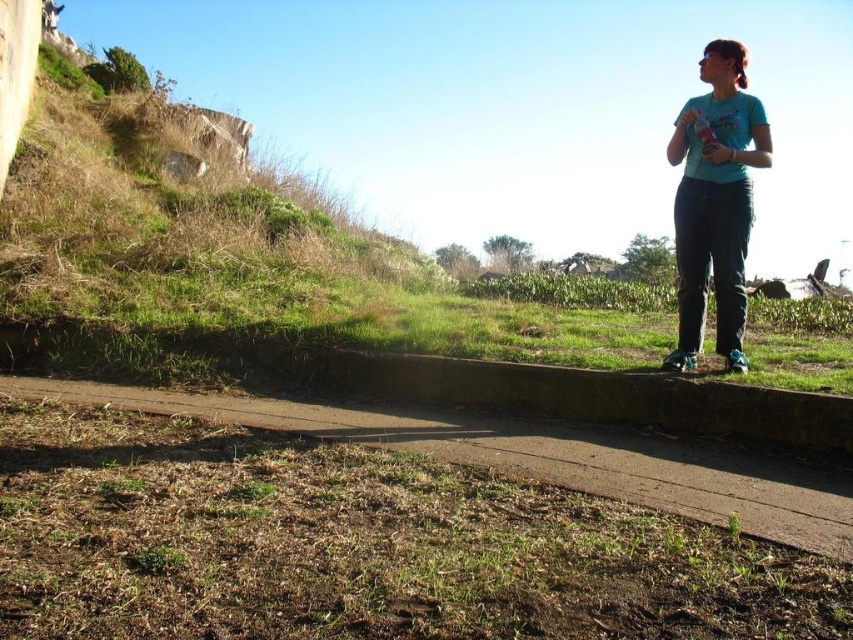
Is point (709, 472) positioned after point (752, 106)?

No, it is in front of (752, 106).

Is point (618, 440) positioned behind point (741, 189)?

No, (618, 440) is in front of (741, 189).

Identify the location of brown concrete path at center. tap(538, 456).